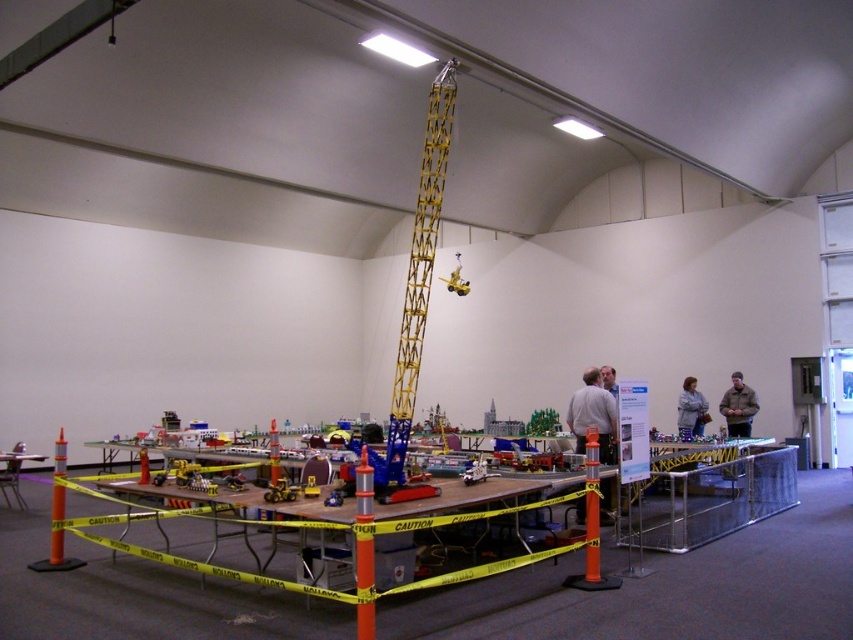
You are an event organizer checking the setup. You notice the yellow metallic crane at center and the light gray fabric jacket at center right are both placed at the center of the table. Since space is limited, which object should you consider moving to make more room?

You should consider moving the yellow metallic crane at center because it occupies less space than the light gray fabric jacket at center right, so removing it would free up more space.

You are a visitor at the exhibition and want to take a photo of the yellow metallic crane at center without including the wooden table at lower left in the frame. Based on their positions, is this possible?

The yellow metallic crane at center is to the right of the wooden table at lower left, so if you position yourself to the right side of the wooden table at lower left and aim towards the crane, you can capture the crane without including the table in the photo.